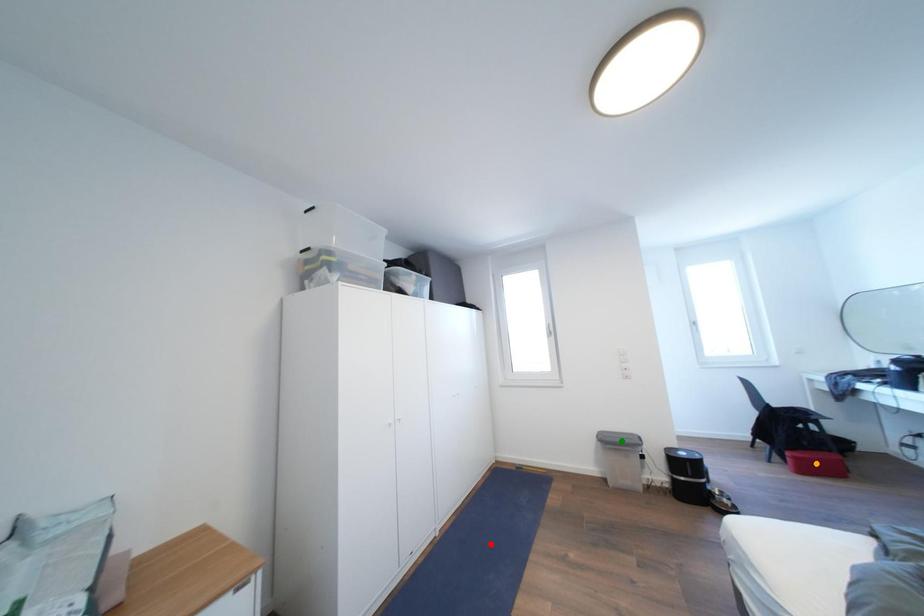
Order these from nearest to farthest:
green point | orange point | red point

1. orange point
2. red point
3. green point